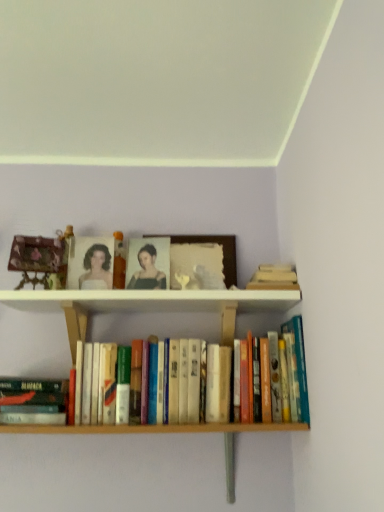
Locate an element on the screen. The width and height of the screenshot is (384, 512). matte black portrait at center is located at coordinates (147, 271).

You are a GUI agent. You are given a task and a screenshot of the screen. Output one action in this format:
    pyautogui.click(x=<x>, y=<y>)
    Task: Click on the wooden picture frame at center
    
    Given the screenshot: What is the action you would take?
    pyautogui.click(x=223, y=252)

Describe the element at coordinates (33, 402) in the screenshot. This screenshot has width=384, height=512. I see `hardcover book at lower left, the first book positioned from the left` at that location.

What do you see at coordinates (41, 259) in the screenshot?
I see `wooden carved figurine at left` at bounding box center [41, 259].

Find the location of a particular element. matte black portrait at center is located at coordinates (147, 271).

Can hardcover books at center, marked as the 2th book in a left-to-right arrangement, be found inside wooden carved figurine at left?

No.

From their relative heights in the image, would you say wooden carved figurine at left is taller or shorter than hardcover books at center, marked as the 2th book in a left-to-right arrangement?

Clearly, wooden carved figurine at left is shorter compared to hardcover books at center, marked as the 2th book in a left-to-right arrangement.

From a real-world perspective, relative to hardcover books at center, which is the first book from right to left, is wooden carved figurine at left vertically above or below?

In terms of real-world spatial position, wooden carved figurine at left is above hardcover books at center, which is the first book from right to left.

Which object is closer to the camera, wooden carved figurine at left or hardcover books at center, which is the first book from right to left?

hardcover books at center, which is the first book from right to left, is in front.

Is wooden carved figurine at left in contact with wooden picture frame at center?

No.

Is wooden carved figurine at left completely or partially outside of wooden picture frame at center?

Indeed, wooden carved figurine at left is completely outside wooden picture frame at center.

Does point (93, 429) appear closer or farther from the camera than point (210, 240)?

Point (93, 429) appears to be closer to the viewer than point (210, 240).

Is hardcover books at center, marked as the 2th book in a left-to-right arrangement, inside the boundaries of wooden picture frame at center, or outside?

hardcover books at center, marked as the 2th book in a left-to-right arrangement, cannot be found inside wooden picture frame at center.

Can you confirm if hardcover books at center, which is the first book from right to left, is taller than wooden picture frame at center?

Yes.

Is hardcover books at center, marked as the 2th book in a left-to-right arrangement, positioned far away from wooden picture frame at center?

No, hardcover books at center, marked as the 2th book in a left-to-right arrangement, is not far from wooden picture frame at center.

The width and height of the screenshot is (384, 512). What are the coordinates of `book in front of the hardcover book at lower left, the first book positioned from the left` in the screenshot? It's located at (161, 428).

From a real-world perspective, is hardcover books at center, which is the first book from right to left, on top of hardcover book at lower left, the first book positioned from the left?

Correct, in the physical world, hardcover books at center, which is the first book from right to left, is higher than hardcover book at lower left, the first book positioned from the left.

Is there a large distance between hardcover books at center, marked as the 2th book in a left-to-right arrangement, and hardcover book at lower left, which appears as the second book when viewed from the right?

No, there isn't a large distance between hardcover books at center, marked as the 2th book in a left-to-right arrangement, and hardcover book at lower left, which appears as the second book when viewed from the right.

Who is shorter, hardcover books at center, which is the first book from right to left, or hardcover book at lower left, which appears as the second book when viewed from the right?

With less height is hardcover book at lower left, which appears as the second book when viewed from the right.

Which is closer to the camera, (64, 270) or (3, 413)?

Point (64, 270) is farther from the camera than point (3, 413).

Does wooden carved figurine at left have a lesser height compared to hardcover book at lower left, the first book positioned from the left?

No.

In the image, is wooden carved figurine at left positioned in front of or behind hardcover book at lower left, which appears as the second book when viewed from the right?

wooden carved figurine at left is behind hardcover book at lower left, which appears as the second book when viewed from the right.

Could you measure the distance between wooden carved figurine at left and hardcover book at lower left, which appears as the second book when viewed from the right?

wooden carved figurine at left and hardcover book at lower left, which appears as the second book when viewed from the right, are 12.92 inches apart.

Consider the image. How many degrees apart are the facing directions of wooden carved figurine at left and matte black portrait at center?

There is a 24.8-degree angle between the facing directions of wooden carved figurine at left and matte black portrait at center.

Where is `person that is below the wooden carved figurine at left (from the image's perspective)`? This screenshot has height=512, width=384. person that is below the wooden carved figurine at left (from the image's perspective) is located at coordinates (147, 271).

From a real-world perspective, which is physically above, wooden carved figurine at left or matte black portrait at center?

wooden carved figurine at left is physically above.

Considering the relative sizes of wooden carved figurine at left and matte black portrait at center in the image provided, is wooden carved figurine at left wider than matte black portrait at center?

Correct, the width of wooden carved figurine at left exceeds that of matte black portrait at center.

Consider the image. Is wooden picture frame at center positioned behind hardcover books at center, which is the first book from right to left?

Yes, it is behind hardcover books at center, which is the first book from right to left.

Can you confirm if wooden picture frame at center is positioned to the left of hardcover books at center, which is the first book from right to left?

In fact, wooden picture frame at center is to the right of hardcover books at center, which is the first book from right to left.

From the image's perspective, which is below, wooden picture frame at center or hardcover books at center, which is the first book from right to left?

hardcover books at center, which is the first book from right to left, is shown below in the image.

From a real-world perspective, which is physically below, wooden picture frame at center or hardcover books at center, which is the first book from right to left?

In real-world perspective, hardcover books at center, which is the first book from right to left, is lower.

You are a GUI agent. You are given a task and a screenshot of the screen. Output one action in this format:
    pyautogui.click(x=<x>, y=<y>)
    Task: Click on the toy on the left side of hardcover books at center, marked as the 2th book in a left-to-right arrangement
    This screenshot has height=512, width=384.
    Given the screenshot: What is the action you would take?
    pyautogui.click(x=41, y=259)

The image size is (384, 512). I want to click on picture frame located above the wooden carved figurine at left (from a real-world perspective), so click(x=223, y=252).

Based on their spatial positions, is wooden carved figurine at left or hardcover books at center, marked as the 2th book in a left-to-right arrangement, further from hardcover book at lower left, the first book positioned from the left?

The object further to hardcover book at lower left, the first book positioned from the left, is wooden carved figurine at left.

Based on their spatial positions, is hardcover books at center, marked as the 2th book in a left-to-right arrangement, or wooden carved figurine at left further from matte black portrait at center?

hardcover books at center, marked as the 2th book in a left-to-right arrangement.

Which object lies further to the anchor point hardcover books at center, marked as the 2th book in a left-to-right arrangement, hardcover book at lower left, the first book positioned from the left, or matte black portrait at center?

Among the two, matte black portrait at center is located further to hardcover books at center, marked as the 2th book in a left-to-right arrangement.

Which object lies further to the anchor point wooden picture frame at center, hardcover books at center, marked as the 2th book in a left-to-right arrangement, or hardcover book at lower left, which appears as the second book when viewed from the right?

The object further to wooden picture frame at center is hardcover book at lower left, which appears as the second book when viewed from the right.

Considering their positions, is hardcover book at lower left, which appears as the second book when viewed from the right, positioned further to wooden picture frame at center than wooden carved figurine at left?

Based on the image, hardcover book at lower left, which appears as the second book when viewed from the right, appears to be further to wooden picture frame at center.

Looking at the image, which one is located closer to wooden picture frame at center, matte black portrait at center or wooden carved figurine at left?

matte black portrait at center is closer to wooden picture frame at center.

When comparing their distances from wooden picture frame at center, does matte black portrait at center or hardcover book at lower left, the first book positioned from the left, seem further?

hardcover book at lower left, the first book positioned from the left, lies further to wooden picture frame at center than the other object.

Looking at the image, which one is located closer to matte black portrait at center, wooden picture frame at center or hardcover book at lower left, the first book positioned from the left?

The object closer to matte black portrait at center is wooden picture frame at center.

Identify the location of book between hardcover book at lower left, which appears as the second book when viewed from the right, and wooden picture frame at center. (161, 428).

Locate an element on the screen. picture frame between matte black portrait at center and hardcover books at center, marked as the 2th book in a left-to-right arrangement, in the up-down direction is located at coordinates pyautogui.click(x=223, y=252).

Image resolution: width=384 pixels, height=512 pixels. What are the coordinates of `book between wooden carved figurine at left and hardcover books at center, marked as the 2th book in a left-to-right arrangement, in the horizontal direction` in the screenshot? It's located at (33, 402).

This screenshot has height=512, width=384. Identify the location of person between wooden carved figurine at left and hardcover book at lower left, which appears as the second book when viewed from the right, vertically. (147, 271).